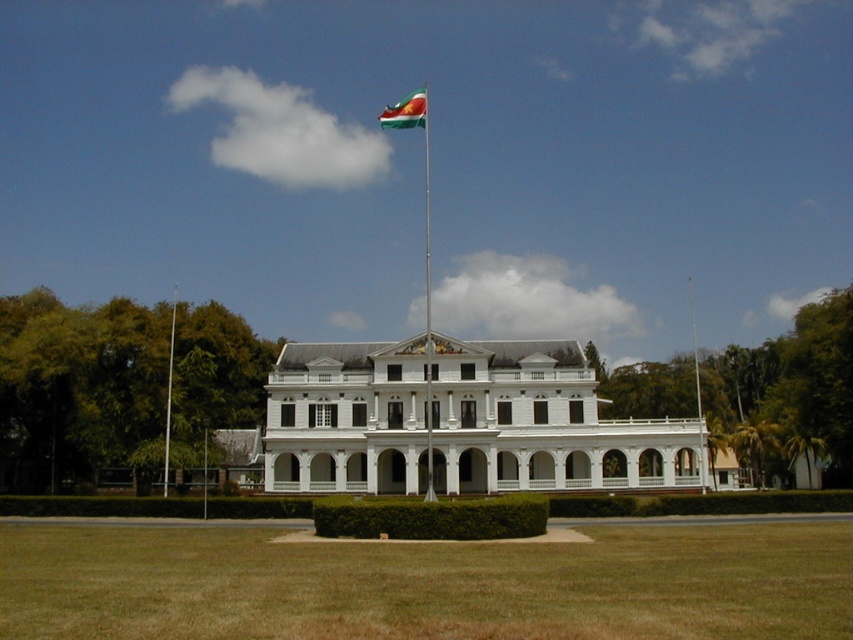
Is polished plastic flag at upper center thinner than white metallic flag pole at center?

Yes.

Which of these two, polished plastic flag at upper center or white metallic flag pole at center, stands shorter?

With less height is polished plastic flag at upper center.

Between point (424, 104) and point (689, 282), which one is positioned in front?

Positioned in front is point (424, 104).

Identify the location of polished plastic flag at upper center. (405, 112).

Does white glossy building at center have a greater height compared to metallic flag pole at center?

Incorrect, white glossy building at center's height is not larger of metallic flag pole at center's.

Which of these two, white glossy building at center or metallic flag pole at center, stands shorter?

Standing shorter between the two is white glossy building at center.

What do you see at coordinates (543, 422) in the screenshot?
I see `white glossy building at center` at bounding box center [543, 422].

You are a GUI agent. You are given a task and a screenshot of the screen. Output one action in this format:
    pyautogui.click(x=<x>, y=<y>)
    Task: Click on the white glossy building at center
    This screenshot has height=640, width=853.
    Given the screenshot: What is the action you would take?
    pyautogui.click(x=543, y=422)

What do you see at coordinates (426, 586) in the screenshot?
I see `green grass at lower center` at bounding box center [426, 586].

This screenshot has height=640, width=853. Identify the location of green grass at lower center. (426, 586).